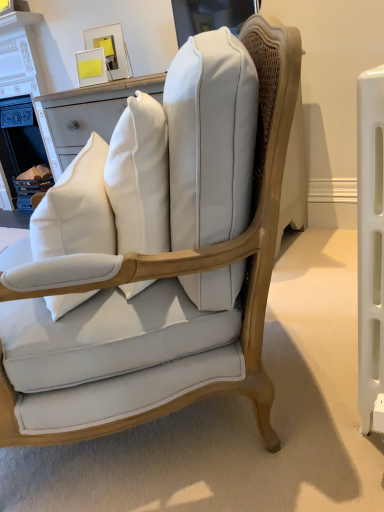
Question: Considering the positions of white cotton throw pillow at center and white painted wood fireplace at upper left in the image, is white cotton throw pillow at center wider or thinner than white painted wood fireplace at upper left?

Choices:
 (A) thin
 (B) wide

Answer: (A)

Question: In the image, is white cotton throw pillow at center on the left side or the right side of white painted wood fireplace at upper left?

Choices:
 (A) right
 (B) left

Answer: (A)

Question: Which of these objects is positioned closest to the white painted wood fireplace at upper left?

Choices:
 (A) matte white cushioned chair at center
 (B) white cotton throw pillow at center

Answer: (B)

Question: Considering the real-world distances, which object is closest to the matte white cushioned chair at center?

Choices:
 (A) white cotton throw pillow at center
 (B) white painted wood fireplace at upper left

Answer: (A)